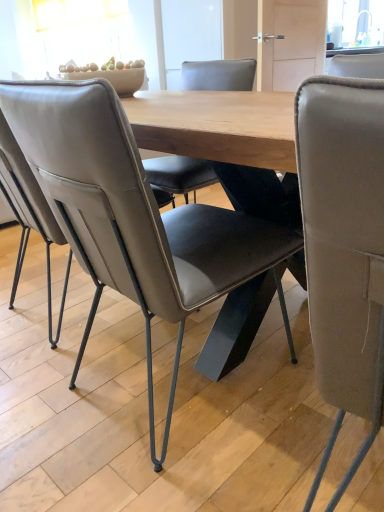
Where is `leather at right, the 2th chair when ordered from left to right`? leather at right, the 2th chair when ordered from left to right is located at coordinates (344, 248).

The image size is (384, 512). What do you see at coordinates (344, 248) in the screenshot?
I see `leather at right, the 2th chair when ordered from left to right` at bounding box center [344, 248].

Find the location of a particular element. leather at center, arranged as the second chair when viewed from the right is located at coordinates (134, 216).

The height and width of the screenshot is (512, 384). What do you see at coordinates (134, 216) in the screenshot?
I see `leather at center, positioned as the 1th chair in left-to-right order` at bounding box center [134, 216].

The image size is (384, 512). I want to click on leather at right, acting as the first chair starting from the right, so click(344, 248).

Is leather at center, arranged as the second chair when viewed from the right, to the right of leather at right, the 2th chair when ordered from left to right, from the viewer's perspective?

Incorrect, leather at center, arranged as the second chair when viewed from the right, is not on the right side of leather at right, the 2th chair when ordered from left to right.

Who is more distant, leather at center, arranged as the second chair when viewed from the right, or leather at right, acting as the first chair starting from the right?

Positioned behind is leather at center, arranged as the second chair when viewed from the right.

Between point (142, 298) and point (336, 176), which one is positioned in front?

The point (336, 176) is closer.

From the image's perspective, relative to leather at right, acting as the first chair starting from the right, is leather at center, arranged as the second chair when viewed from the right, above or below?

leather at center, arranged as the second chair when viewed from the right, is situated higher than leather at right, acting as the first chair starting from the right, in the image.

From a real-world perspective, who is located lower, leather at center, arranged as the second chair when viewed from the right, or leather at right, the 2th chair when ordered from left to right?

leather at right, the 2th chair when ordered from left to right.

Considering the relative sizes of leather at center, arranged as the second chair when viewed from the right, and leather at right, acting as the first chair starting from the right, in the image provided, is leather at center, arranged as the second chair when viewed from the right, wider than leather at right, acting as the first chair starting from the right,?

In fact, leather at center, arranged as the second chair when viewed from the right, might be narrower than leather at right, acting as the first chair starting from the right.

Considering the relative sizes of leather at center, positioned as the 1th chair in left-to-right order, and leather at right, acting as the first chair starting from the right, in the image provided, is leather at center, positioned as the 1th chair in left-to-right order, shorter than leather at right, acting as the first chair starting from the right,?

Correct, leather at center, positioned as the 1th chair in left-to-right order, is not as tall as leather at right, acting as the first chair starting from the right.

Who is smaller, leather at center, arranged as the second chair when viewed from the right, or leather at right, acting as the first chair starting from the right?

leather at right, acting as the first chair starting from the right.

From the picture: Is leather at center, positioned as the 1th chair in left-to-right order, surrounding leather at right, acting as the first chair starting from the right?

No, leather at right, acting as the first chair starting from the right, is not a part of leather at center, positioned as the 1th chair in left-to-right order.

Are leather at center, positioned as the 1th chair in left-to-right order, and leather at right, acting as the first chair starting from the right, located far from each other?

No, there isn't a large distance between leather at center, positioned as the 1th chair in left-to-right order, and leather at right, acting as the first chair starting from the right.

Consider the image. Is leather at right, the 2th chair when ordered from left to right, at the back of leather at center, arranged as the second chair when viewed from the right?

leather at center, arranged as the second chair when viewed from the right, does not have its back to leather at right, the 2th chair when ordered from left to right.

Can you tell me how much leather at center, arranged as the second chair when viewed from the right, and leather at right, the 2th chair when ordered from left to right, differ in facing direction?

The facing directions of leather at center, arranged as the second chair when viewed from the right, and leather at right, the 2th chair when ordered from left to right, are 5.51 degrees apart.

Where is `chair in front of the leather at center, positioned as the 1th chair in left-to-right order`? chair in front of the leather at center, positioned as the 1th chair in left-to-right order is located at coordinates (344, 248).

Visually, is leather at right, acting as the first chair starting from the right, positioned to the left or to the right of leather at center, positioned as the 1th chair in left-to-right order?

Based on their positions, leather at right, acting as the first chair starting from the right, is located to the right of leather at center, positioned as the 1th chair in left-to-right order.

Considering the positions of objects leather at right, the 2th chair when ordered from left to right, and leather at center, arranged as the second chair when viewed from the right, in the image provided, who is in front, leather at right, the 2th chair when ordered from left to right, or leather at center, arranged as the second chair when viewed from the right,?

Positioned in front is leather at right, the 2th chair when ordered from left to right.

Is point (342, 336) closer to viewer compared to point (170, 215)?

Yes.

From the image's perspective, is leather at right, the 2th chair when ordered from left to right, above leather at center, arranged as the second chair when viewed from the right?

No, from the image's perspective, leather at right, the 2th chair when ordered from left to right, is not above leather at center, arranged as the second chair when viewed from the right.

From a real-world perspective, is leather at right, acting as the first chair starting from the right, above or below leather at center, arranged as the second chair when viewed from the right?

From a real-world perspective, leather at right, acting as the first chair starting from the right, is physically below leather at center, arranged as the second chair when viewed from the right.

Considering the sizes of objects leather at right, the 2th chair when ordered from left to right, and leather at center, positioned as the 1th chair in left-to-right order, in the image provided, who is wider, leather at right, the 2th chair when ordered from left to right, or leather at center, positioned as the 1th chair in left-to-right order,?

leather at right, the 2th chair when ordered from left to right.

In terms of height, does leather at right, acting as the first chair starting from the right, look taller or shorter compared to leather at center, arranged as the second chair when viewed from the right?

Clearly, leather at right, acting as the first chair starting from the right, is taller compared to leather at center, arranged as the second chair when viewed from the right.

Is leather at right, acting as the first chair starting from the right, bigger than leather at center, arranged as the second chair when viewed from the right?

No, leather at right, acting as the first chair starting from the right, is not bigger than leather at center, arranged as the second chair when viewed from the right.

Is leather at right, acting as the first chair starting from the right, located outside leather at center, positioned as the 1th chair in left-to-right order?

leather at right, acting as the first chair starting from the right, is positioned outside leather at center, positioned as the 1th chair in left-to-right order.

Are leather at right, acting as the first chair starting from the right, and leather at center, positioned as the 1th chair in left-to-right order, far apart?

That's not correct — leather at right, acting as the first chair starting from the right, is a little close to leather at center, positioned as the 1th chair in left-to-right order.

Could you tell me if leather at right, the 2th chair when ordered from left to right, is facing leather at center, positioned as the 1th chair in left-to-right order?

No.

What's the angular difference between leather at right, acting as the first chair starting from the right, and leather at center, positioned as the 1th chair in left-to-right order,'s facing directions?

The angular difference between leather at right, acting as the first chair starting from the right, and leather at center, positioned as the 1th chair in left-to-right order, is 5.51 degrees.

At what (x,y) coordinates should I click in order to perform the action: click on chair that appears above the leather at right, acting as the first chair starting from the right (from a real-world perspective). Please return your answer as a coordinate pair (x, y). The height and width of the screenshot is (512, 384). Looking at the image, I should click on (134, 216).

The height and width of the screenshot is (512, 384). Identify the location of chair in front of the leather at center, positioned as the 1th chair in left-to-right order. (344, 248).

I want to click on chair that appears above the leather at right, acting as the first chair starting from the right (from a real-world perspective), so click(x=134, y=216).